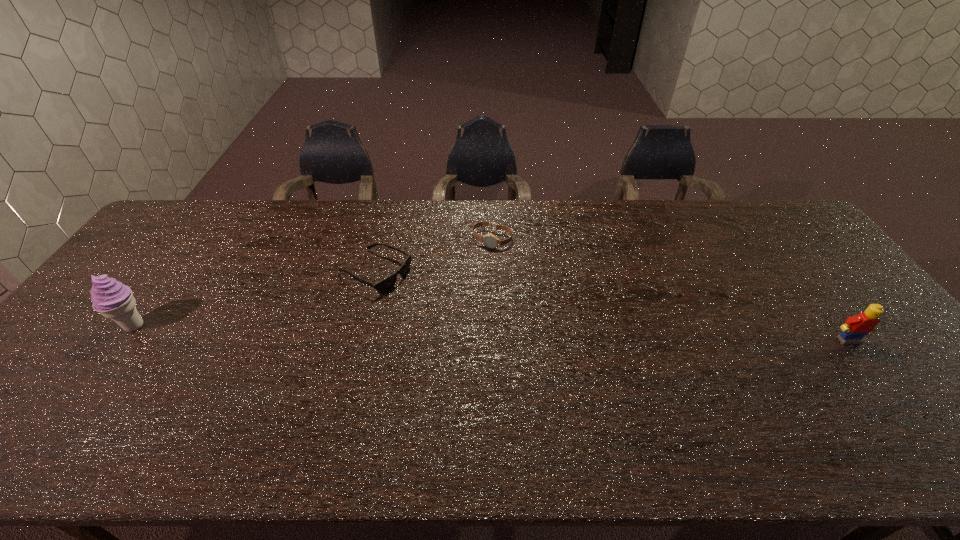
This screenshot has height=540, width=960. What are the coordinates of `icecream` in the screenshot? It's located at (114, 300).

Where is `the leftmost object`? This screenshot has height=540, width=960. the leftmost object is located at coordinates (114, 300).

I want to click on the rightmost object, so click(855, 328).

You are a GUI agent. You are given a task and a screenshot of the screen. Output one action in this format:
    pyautogui.click(x=<x>, y=<y>)
    Task: Click on the Lego
    Image resolution: width=960 pixels, height=540 pixels.
    Given the screenshot: What is the action you would take?
    pyautogui.click(x=855, y=328)

You are a GUI agent. You are given a task and a screenshot of the screen. Output one action in this format:
    pyautogui.click(x=<x>, y=<y>)
    Task: Click on the third object from left to right
    
    Given the screenshot: What is the action you would take?
    pyautogui.click(x=489, y=240)

The width and height of the screenshot is (960, 540). What are the coordinates of `the third object from right to left` in the screenshot? It's located at (386, 284).

I want to click on free region located 0.280m on the right of the leftmost object, so click(255, 326).

At what (x,y) coordinates should I click in order to perform the action: click on blank space located 0.120m on the front-facing side of the rightmost object. Please return your answer as a coordinate pair (x, y). The image size is (960, 540). Looking at the image, I should click on (882, 386).

Find the location of a particular element. The image size is (960, 540). vacant space located on the face of the watch is located at coordinates pos(480,259).

In order to click on vacant position located on the face of the watch in this screenshot , I will do `click(463, 292)`.